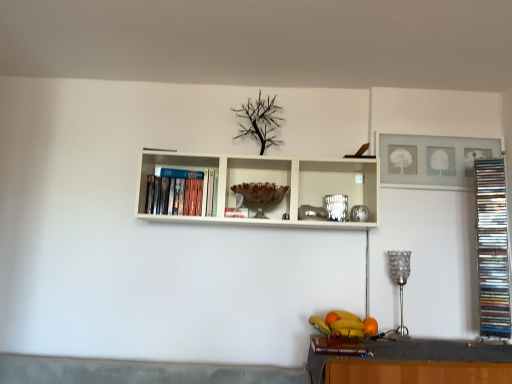
Question: Considering the positions of brown glass bowl at center and orange matte at lower right in the image, is brown glass bowl at center taller or shorter than orange matte at lower right?

Choices:
 (A) tall
 (B) short

Answer: (A)

Question: In the image, is brown glass bowl at center on the left side or the right side of orange matte at lower right?

Choices:
 (A) right
 (B) left

Answer: (B)

Question: Which object is positioned farthest from the shiny metallic fruit basket at lower center?

Choices:
 (A) brown glass bowl at center
 (B) matte brown book at lower center, the third book when ordered from back to front
 (C) metallic silver stack of cds at right, which is the 1th book from right to left
 (D) matte plastic dvds at left, which is the first book in left-to-right order
 (E) orange matte at lower right

Answer: (D)

Question: Which object is the closest to the orange matte at lower right?

Choices:
 (A) brown glass bowl at center
 (B) matte plastic dvds at left, which is the first book in left-to-right order
 (C) matte brown book at lower center, the second book when ordered from right to left
 (D) metallic silver stack of cds at right, which is the 2th book in back-to-front order
 (E) shiny metallic fruit basket at lower center

Answer: (E)